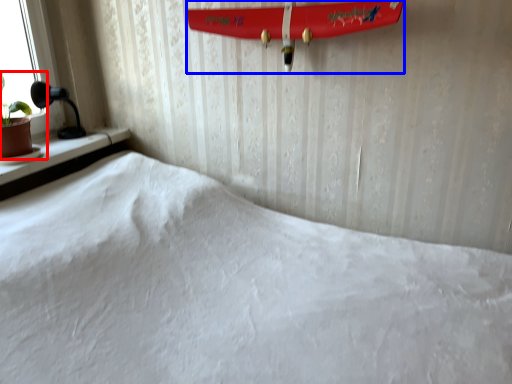
Question: Which object is further to the camera taking this photo, houseplant (highlighted by a red box) or surfboard (highlighted by a blue box)?

Choices:
 (A) houseplant
 (B) surfboard

Answer: (A)